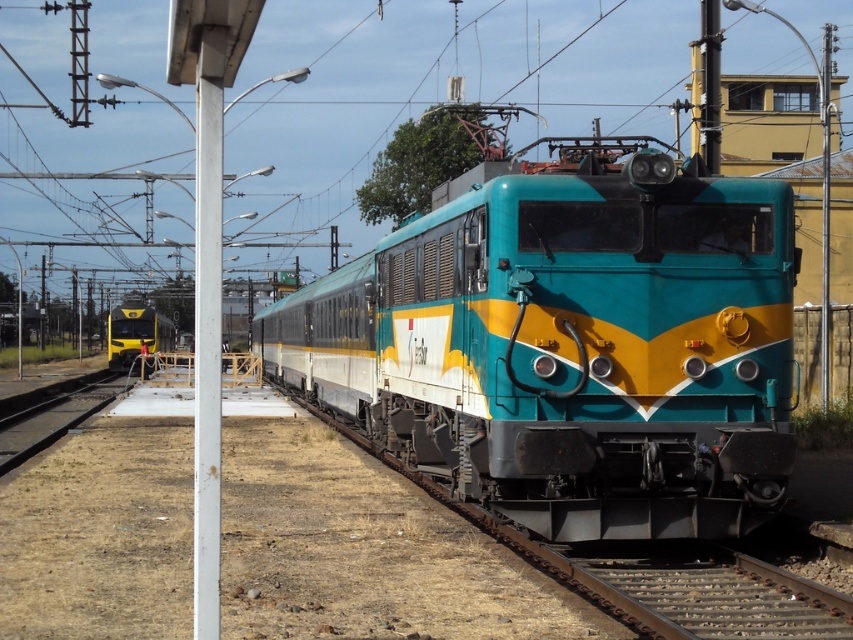
This screenshot has height=640, width=853. What do you see at coordinates (570, 346) in the screenshot?
I see `teal glossy train at center` at bounding box center [570, 346].

Can you confirm if teal glossy train at center is wider than yellow glossy train at left?

Correct, the width of teal glossy train at center exceeds that of yellow glossy train at left.

Where is `teal glossy train at center`? The image size is (853, 640). teal glossy train at center is located at coordinates (570, 346).

Locate an element on the screen. teal glossy train at center is located at coordinates (570, 346).